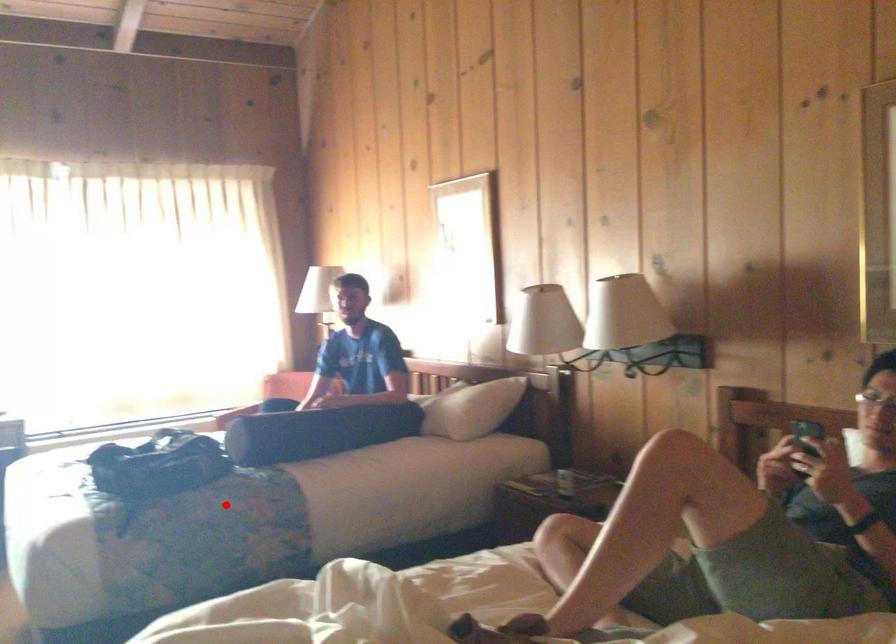
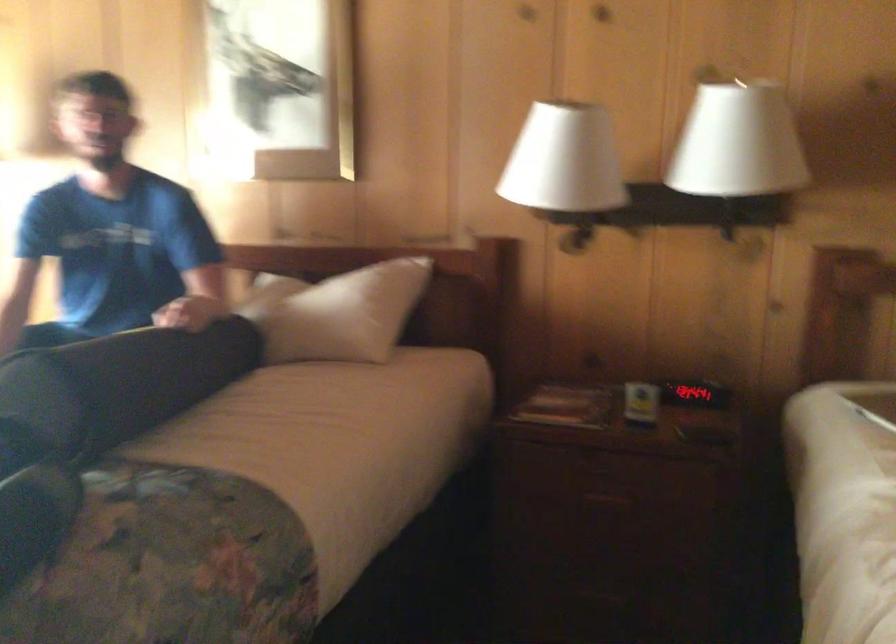
Find the pixel in the second image that matches the highlighted location in the first image.

(170, 565)